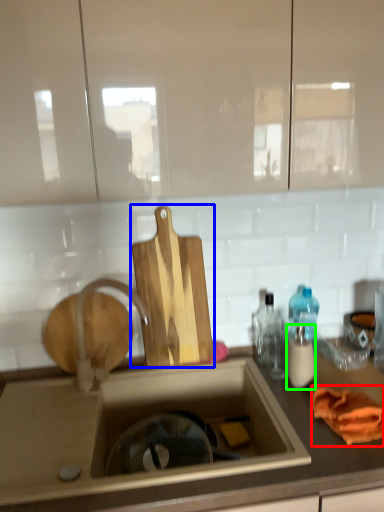
Question: Based on their relative distances, which object is farther from material (highlighted by a red box)? Choose from cutting board (highlighted by a blue box) and bottle (highlighted by a green box).

Choices:
 (A) cutting board
 (B) bottle

Answer: (A)